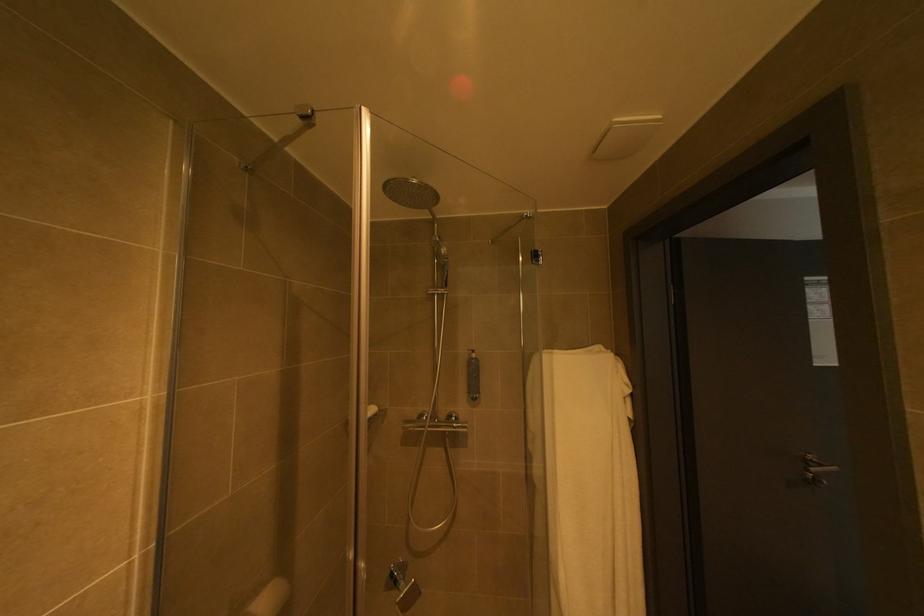
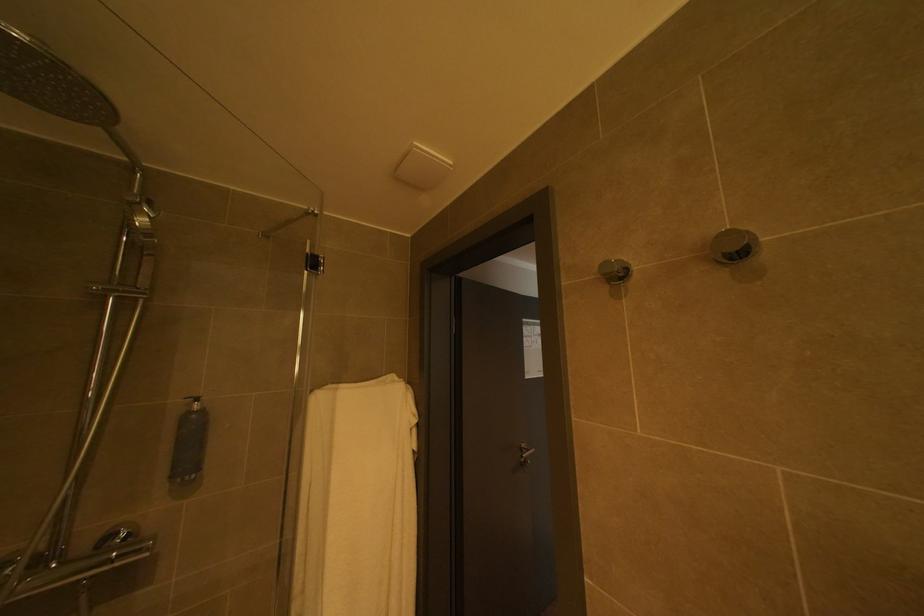
Find the pixel in the second image that matches (819,463) in the first image.

(533, 450)